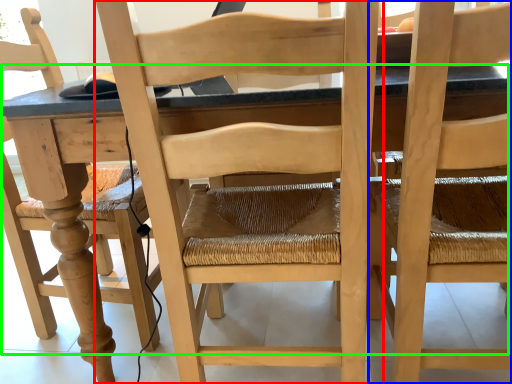
Question: Based on their relative distances, which object is nearer to chair (highlighted by a red box)? Choose from chair (highlighted by a blue box) and table (highlighted by a green box).

Choices:
 (A) chair
 (B) table

Answer: (B)